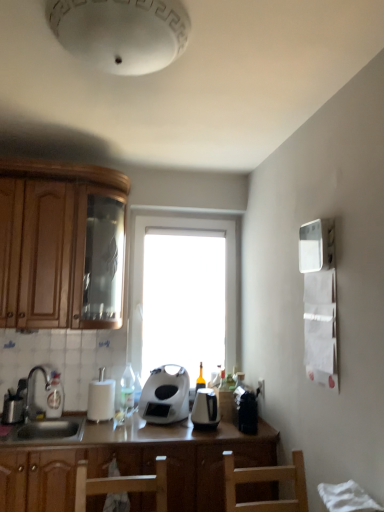
Question: Can you confirm if white glossy bottle at center, which is the 1th bottle from right to left, is bigger than white matte paper towel holder at center?

Choices:
 (A) yes
 (B) no

Answer: (B)

Question: Can we say white glossy bottle at center, which is the 1th bottle from right to left, lies outside white matte paper towel holder at center?

Choices:
 (A) yes
 (B) no

Answer: (A)

Question: Is white glossy bottle at center, which is the second bottle from left to right, taller than white matte paper towel holder at center?

Choices:
 (A) yes
 (B) no

Answer: (B)

Question: Would you say white glossy bottle at center, which is the 1th bottle from right to left, contains white matte paper towel holder at center?

Choices:
 (A) no
 (B) yes

Answer: (A)

Question: Is white glossy bottle at center, which is the 1th bottle from right to left, facing away from white matte paper towel holder at center?

Choices:
 (A) yes
 (B) no

Answer: (B)

Question: In the image, is wooden cabinet at left positioned in front of or behind brown wood countertop at center?

Choices:
 (A) front
 (B) behind

Answer: (B)

Question: Would you say wooden cabinet at left is to the left or to the right of brown wood countertop at center in the picture?

Choices:
 (A) right
 (B) left

Answer: (B)

Question: Is wooden cabinet at left bigger or smaller than brown wood countertop at center?

Choices:
 (A) small
 (B) big

Answer: (A)

Question: In terms of height, does wooden cabinet at left look taller or shorter compared to brown wood countertop at center?

Choices:
 (A) short
 (B) tall

Answer: (B)

Question: Is translucent glass bottle at sink left, arranged as the 1th bottle when viewed from the left, in front of or behind white matte toaster at center, which is the second kitchen appliance from right to left, in the image?

Choices:
 (A) behind
 (B) front

Answer: (A)

Question: Is translucent glass bottle at sink left, marked as the 2th bottle in a right-to-left arrangement, wider or thinner than white matte toaster at center, arranged as the 1th kitchen appliance when viewed from the left?

Choices:
 (A) wide
 (B) thin

Answer: (B)

Question: From a real-world perspective, is translucent glass bottle at sink left, arranged as the 1th bottle when viewed from the left, above or below white matte toaster at center, arranged as the 1th kitchen appliance when viewed from the left?

Choices:
 (A) above
 (B) below

Answer: (B)

Question: From their relative heights in the image, would you say translucent glass bottle at sink left, marked as the 2th bottle in a right-to-left arrangement, is taller or shorter than white matte toaster at center, arranged as the 1th kitchen appliance when viewed from the left?

Choices:
 (A) tall
 (B) short

Answer: (B)

Question: From the image's perspective, relative to transparent glass window at center, is white glossy bottle at center, which is the 1th bottle from right to left, above or below?

Choices:
 (A) below
 (B) above

Answer: (A)

Question: In the image, is white glossy bottle at center, which is the 1th bottle from right to left, positioned in front of or behind transparent glass window at center?

Choices:
 (A) front
 (B) behind

Answer: (A)